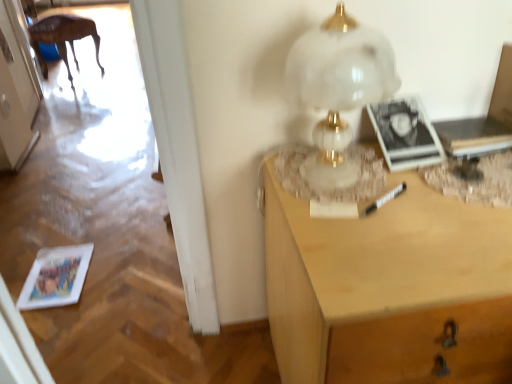
Identify the location of vacant space that's between white glossy door at upper left and matte paper magazine at lower left. The image size is (512, 384). (45, 185).